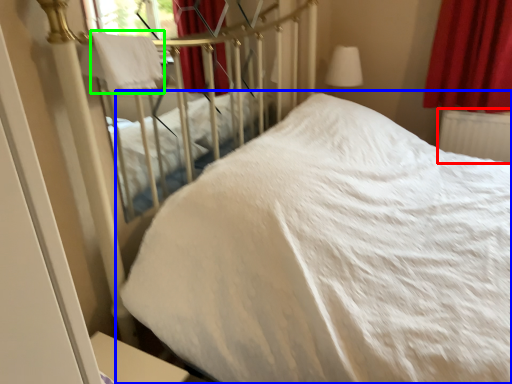
Question: Based on their relative distances, which object is farther from radiator (highlighted by a red box)? Choose from bed (highlighted by a blue box) and blanket (highlighted by a green box).

Choices:
 (A) bed
 (B) blanket

Answer: (B)